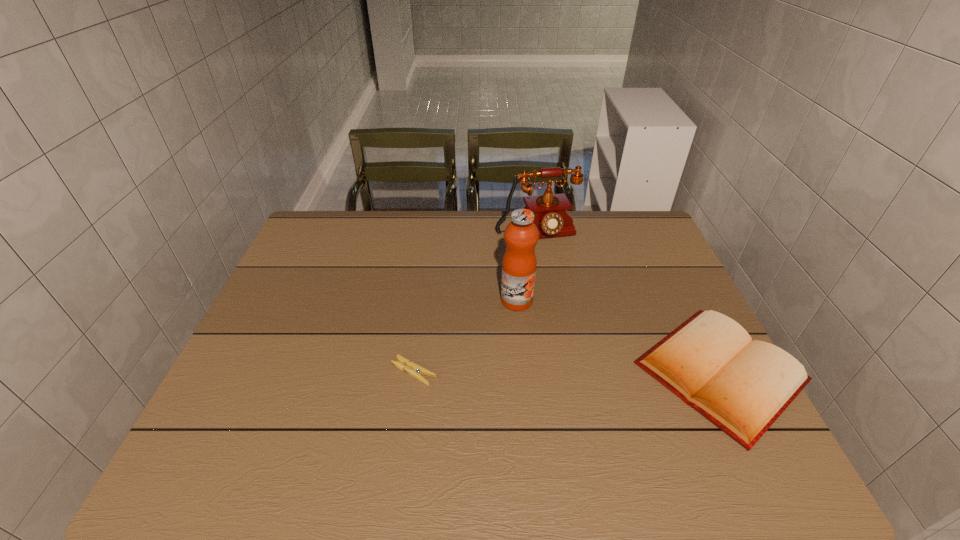
Where is `vacant space on the desktop that is between the leftmost object and the Bible and is positioned on the dial of the telephone`? Image resolution: width=960 pixels, height=540 pixels. vacant space on the desktop that is between the leftmost object and the Bible and is positioned on the dial of the telephone is located at coordinates (599, 372).

Locate an element on the screen. vacant space on the desktop that is between the clothespin and the Bible and is positioned on the front label of the tallest object is located at coordinates (546, 372).